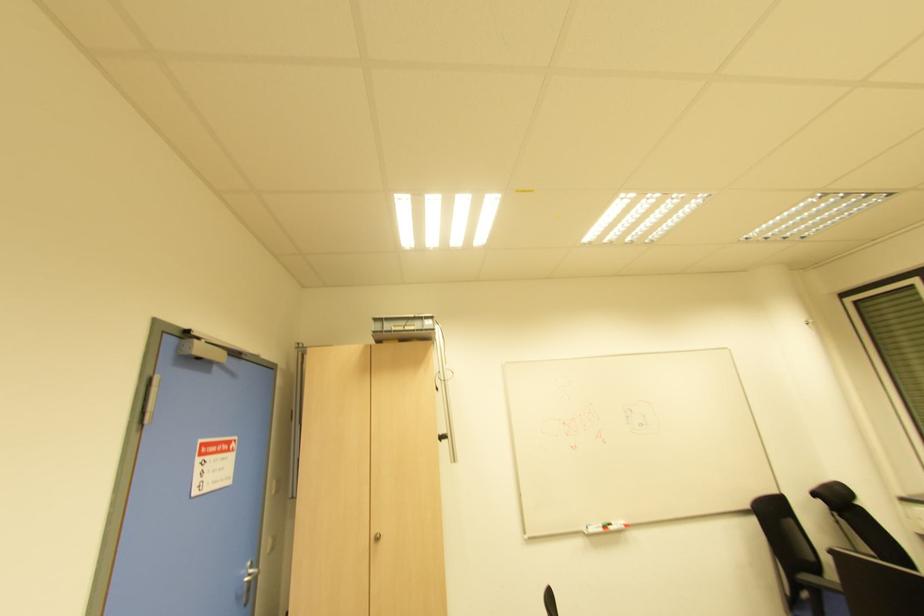
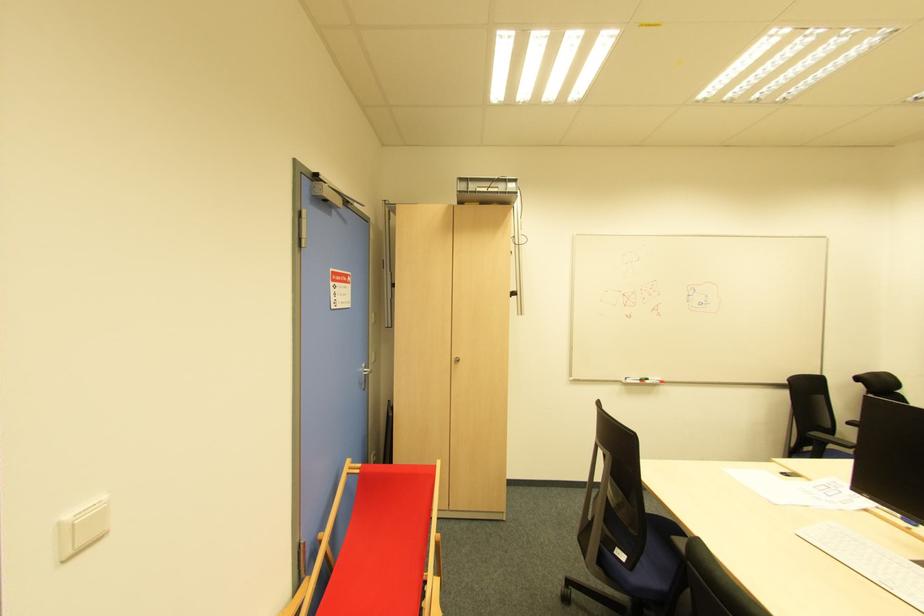
The point at (377, 539) is marked in the first image. Where is the corresponding point in the second image?

(457, 362)